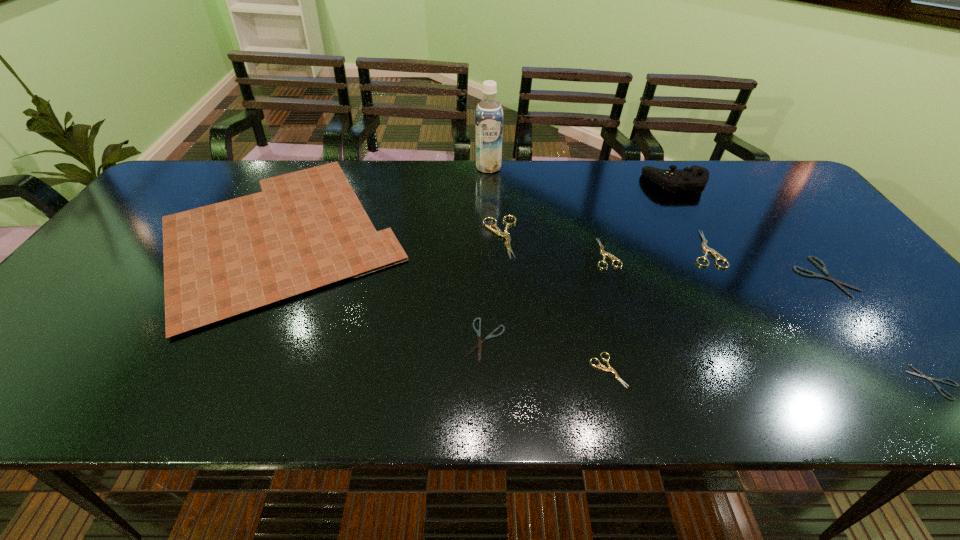
You are a GUI agent. You are given a task and a screenshot of the screen. Output one action in this format:
    pyautogui.click(x=<x>, y=<y>)
    Task: Click on the object positioned at the far left corner
    The image size is (960, 540).
    Given the screenshot: What is the action you would take?
    pyautogui.click(x=306, y=229)

Where is `vacant space at the far edge of the desktop`? Image resolution: width=960 pixels, height=540 pixels. vacant space at the far edge of the desktop is located at coordinates (528, 170).

What are the coordinates of `free space at the near edge of the desktop` in the screenshot? It's located at (139, 383).

Where is `vacant space at the left edge of the desktop`? The width and height of the screenshot is (960, 540). vacant space at the left edge of the desktop is located at coordinates (161, 251).

In order to click on free location at the far left corner of the desktop in this screenshot , I will do `click(192, 169)`.

The image size is (960, 540). In the image, there is a desktop. Identify the location of vacant space at the far right corner. click(748, 160).

Locate an element on the screen. The height and width of the screenshot is (540, 960). vacant space that's between the leftmost beige shears and the tallest object is located at coordinates (494, 202).

This screenshot has height=540, width=960. What are the coordinates of `unoccupied position between the farthest black shears and the second tallest object` in the screenshot? It's located at (750, 230).

I want to click on free space that is in between the second tallest object and the second beige shears from right to left, so click(x=641, y=218).

At what (x,y) coordinates should I click in order to perform the action: click on free space between the sixth object from right to left and the tallest shears. Please return your answer as a coordinate pair (x, y). Image resolution: width=960 pixels, height=540 pixels. Looking at the image, I should click on (554, 303).